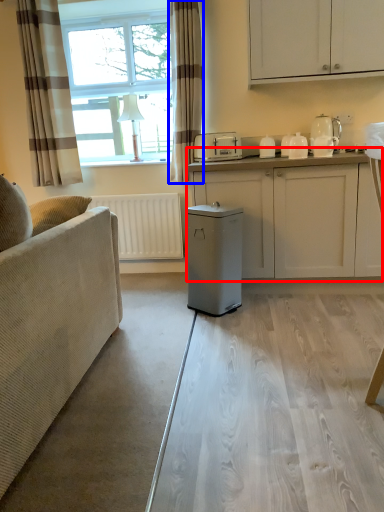
Question: Among these objects, which one is nearest to the camera, cabinetry (highlighted by a red box) or curtain (highlighted by a blue box)?

Choices:
 (A) cabinetry
 (B) curtain

Answer: (A)